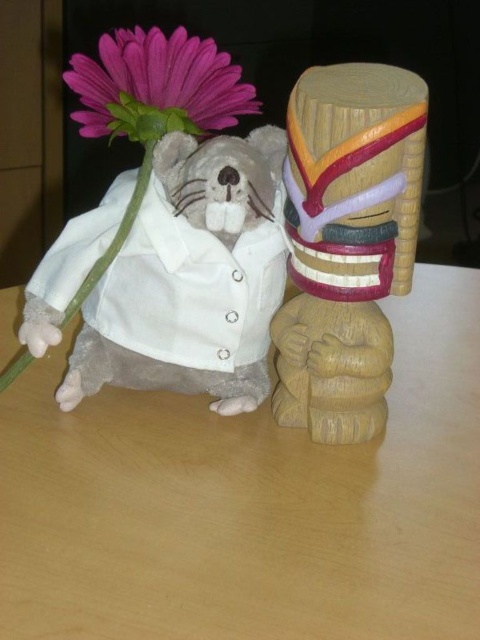
Question: Among these points, which one is nearest to the camera?

Choices:
 (A) (383, 600)
 (B) (158, 372)

Answer: (A)

Question: Is fluffy gray teddy bear at left bigger than purple matte flower at upper left?

Choices:
 (A) no
 (B) yes

Answer: (B)

Question: Is the position of wooden table at center less distant than that of purple matte flower at upper left?

Choices:
 (A) no
 (B) yes

Answer: (B)

Question: Which point is farther to the camera?

Choices:
 (A) (182, 74)
 (B) (262, 376)

Answer: (B)

Question: Where is fluffy gray teddy bear at left located in relation to wooden mask at center in the image?

Choices:
 (A) above
 (B) below

Answer: (B)

Question: Which point is closer to the camera taking this photo?

Choices:
 (A) (421, 556)
 (B) (134, 115)
 (C) (204, 240)

Answer: (A)